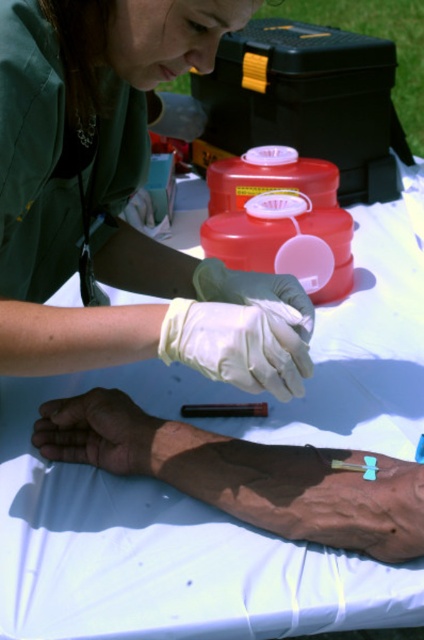
You are a patient observing the healthcare professional in the scene. Which object, the matte green uniform at upper left or the dry skin at center, is positioned higher from the ground?

The matte green uniform at upper left is higher than the dry skin at center.

You are a patient in the medical scene and need to locate two specific points on the table. The first point is at coordinates point(x=295, y=282) and the second is at point(x=75, y=416). Which point is closer to you?

Point(x=75, y=416) is closer to you because it is in front of point(x=295, y=282).

You are a nurse observing a blood draw procedure. You notice the dry skin at center and the blue latex glove at center. Which object is positioned to the right?

The blue latex glove at center is positioned to the right of the dry skin at center.